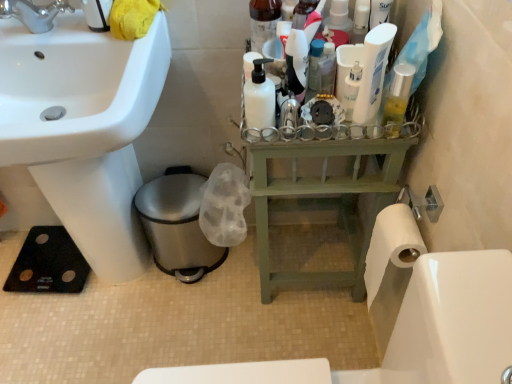
Question: From the image's perspective, is white matte bottle at center located above or below white glossy lotion at center, which is the 3th toiletry in left-to-right order?

Choices:
 (A) below
 (B) above

Answer: (A)

Question: Looking at their shapes, would you say white matte bottle at center is wider or thinner than white glossy lotion at center, marked as the 1th toiletry in a right-to-left arrangement?

Choices:
 (A) thin
 (B) wide

Answer: (B)

Question: Considering the real-world distances, which object is farthest from the translucent plastic pump bottle at upper center, positioned as the first toiletry in left-to-right order?

Choices:
 (A) black rubber mat at lower left
 (B) white glossy sink at lower left
 (C) matte black bottle at center, arranged as the second toiletry when viewed from the left
 (D) white plastic tube at upper center
 (E) white matte bottle at center

Answer: (A)

Question: Which object is positioned closest to the translucent plastic pump bottle at upper center, positioned as the first toiletry in left-to-right order?

Choices:
 (A) white plastic tube at upper center
 (B) green wood balustrade at center
 (C) white glossy lotion at center, which is the 3th toiletry in left-to-right order
 (D) matte black bottle at center, arranged as the second toiletry when viewed from the left
 (E) white matte bottle at center

Answer: (D)